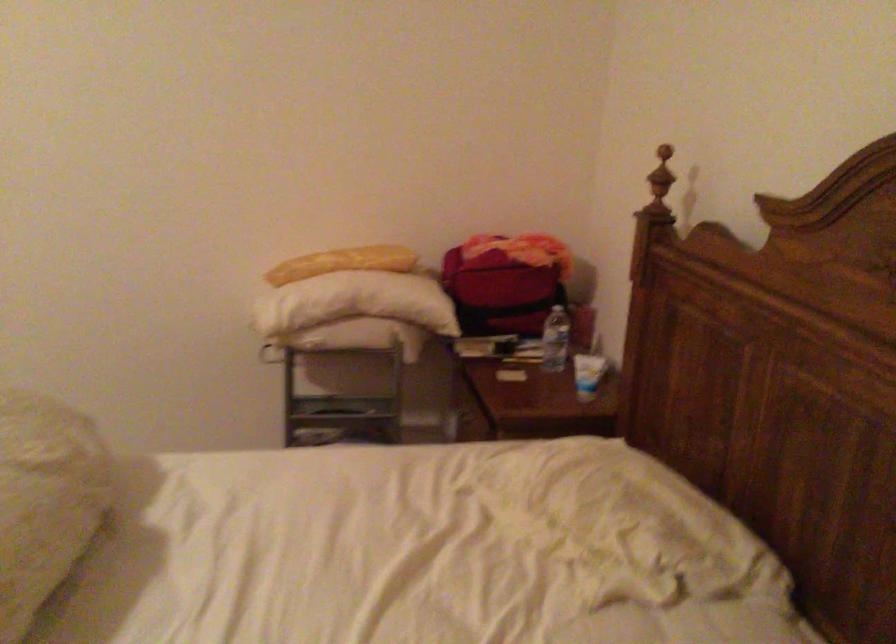
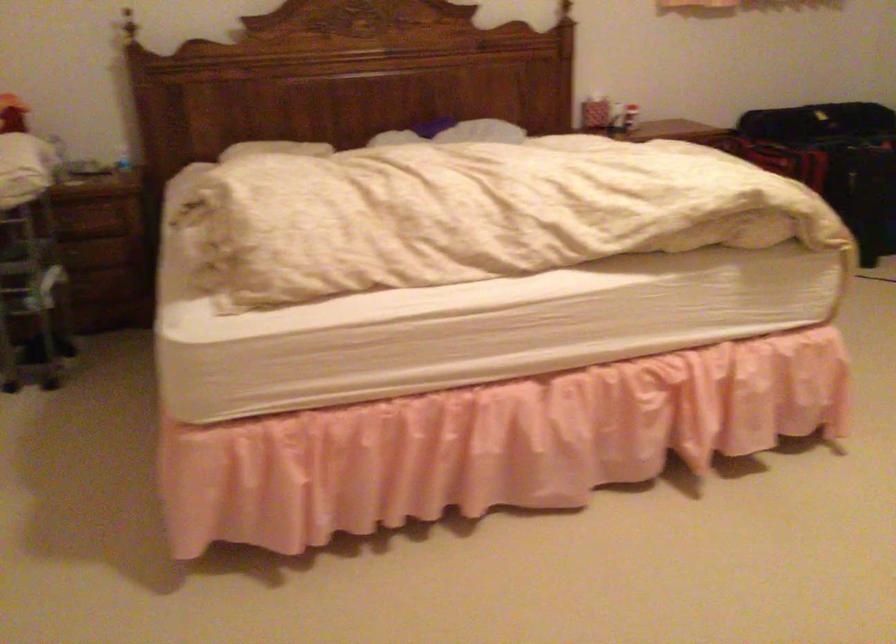
Where in the second image is the point corresponding to pixel 406 339 from the first image?

(59, 158)